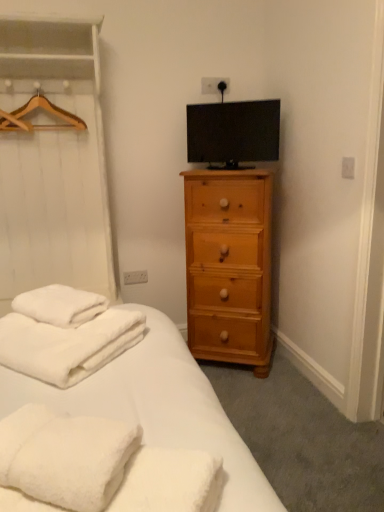
Where is `matte black tv at upper center`? The width and height of the screenshot is (384, 512). matte black tv at upper center is located at coordinates (233, 133).

Does wooden hanger at upper left come in front of matte black tv at upper center?

Yes, the depth of wooden hanger at upper left is less than that of matte black tv at upper center.

From a real-world perspective, which object rests below the other?

In real-world perspective, matte black tv at upper center is lower.

From the image's perspective, does wooden hanger at upper left appear lower than matte black tv at upper center?

Incorrect, from the image's perspective, wooden hanger at upper left is higher than matte black tv at upper center.

Measure the distance from light brown wood chest of drawers at right to white fluffy towels at lower left.

They are 1.08 meters apart.

Is light brown wood chest of drawers at right facing away from white fluffy towels at lower left?

light brown wood chest of drawers at right does not have its back to white fluffy towels at lower left.

Considering the relative sizes of light brown wood chest of drawers at right and white fluffy towels at lower left in the image provided, is light brown wood chest of drawers at right thinner than white fluffy towels at lower left?

Indeed, light brown wood chest of drawers at right has a lesser width compared to white fluffy towels at lower left.

In terms of height, does light brown wood chest of drawers at right look taller or shorter compared to white fluffy towels at lower left?

In the image, light brown wood chest of drawers at right appears to be taller than white fluffy towels at lower left.

Considering the positions of objects white fluffy towels at lower left and wooden hanger at upper left in the image provided, who is behind, white fluffy towels at lower left or wooden hanger at upper left?

wooden hanger at upper left is behind.

Is white fluffy towels at lower left far away from wooden hanger at upper left?

Indeed, white fluffy towels at lower left is not near wooden hanger at upper left.

Between white fluffy towels at lower left and wooden hanger at upper left, which one appears on the left side from the viewer's perspective?

wooden hanger at upper left.

Does white fluffy towels at lower left turn towards wooden hanger at upper left?

No, white fluffy towels at lower left is not oriented towards wooden hanger at upper left.

Is the depth of matte black tv at upper center greater than that of wooden hanger at upper left?

Yes, matte black tv at upper center is behind wooden hanger at upper left.

Does point (278, 135) lie behind point (26, 121)?

That is True.

The height and width of the screenshot is (512, 384). Find the location of `television below the wooden hanger at upper left (from a real-world perspective)`. television below the wooden hanger at upper left (from a real-world perspective) is located at coordinates (233, 133).

Does matte black tv at upper center touch wooden hanger at upper left?

matte black tv at upper center and wooden hanger at upper left are clearly separated.

Does wooden hanger at upper left lie behind white fluffy towels at lower left?

Yes, wooden hanger at upper left is further from the viewer.

Is wooden hanger at upper left inside or outside of white fluffy towels at lower left?

wooden hanger at upper left lies outside white fluffy towels at lower left.

Is wooden hanger at upper left thinner than white fluffy towels at lower left?

Indeed, wooden hanger at upper left has a lesser width compared to white fluffy towels at lower left.

From a real-world perspective, is wooden hanger at upper left physically located above or below white fluffy towels at lower left?

From a real-world perspective, wooden hanger at upper left is physically above white fluffy towels at lower left.

Looking at this image, is matte black tv at upper center next to light brown wood chest of drawers at right and touching it?

No, matte black tv at upper center is not with light brown wood chest of drawers at right.

From a real-world perspective, which is physically above, matte black tv at upper center or light brown wood chest of drawers at right?

matte black tv at upper center.

Measure the distance from matte black tv at upper center to light brown wood chest of drawers at right.

A distance of 17.30 inches exists between matte black tv at upper center and light brown wood chest of drawers at right.

Which object is further away from the camera, matte black tv at upper center or light brown wood chest of drawers at right?

matte black tv at upper center is further away from the camera.

Does light brown wood chest of drawers at right have a lesser width compared to matte black tv at upper center?

Incorrect, the width of light brown wood chest of drawers at right is not less than that of matte black tv at upper center.

Image resolution: width=384 pixels, height=512 pixels. What are the coordinates of `the chest of drawers in front of the matte black tv at upper center` in the screenshot? It's located at (229, 266).

Could you tell me if light brown wood chest of drawers at right is facing matte black tv at upper center?

No.

Considering the positions of objects light brown wood chest of drawers at right and matte black tv at upper center in the image provided, who is more to the right, light brown wood chest of drawers at right or matte black tv at upper center?

From the viewer's perspective, light brown wood chest of drawers at right appears more on the right side.

Locate an element on the screen. This screenshot has width=384, height=512. hanger above the matte black tv at upper center (from a real-world perspective) is located at coordinates (34, 109).

Find the location of a particular element. The image size is (384, 512). the chest of drawers that is behind the white fluffy towels at lower left is located at coordinates (229, 266).

Considering their positions, is matte black tv at upper center positioned closer to wooden hanger at upper left than white fluffy towels at lower left?

The object closer to wooden hanger at upper left is matte black tv at upper center.

Looking at this image, estimate the real-world distances between objects in this image. Which object is closer to light brown wood chest of drawers at right, white fluffy towels at lower left or wooden hanger at upper left?

The object closer to light brown wood chest of drawers at right is wooden hanger at upper left.

Considering their positions, is white fluffy towels at lower left positioned closer to matte black tv at upper center than wooden hanger at upper left?

wooden hanger at upper left lies closer to matte black tv at upper center than the other object.

Considering their positions, is wooden hanger at upper left positioned closer to light brown wood chest of drawers at right than white fluffy towels at lower left?

wooden hanger at upper left.

Considering their positions, is wooden hanger at upper left positioned further to matte black tv at upper center than white fluffy towels at lower left?

white fluffy towels at lower left.

From the image, which object appears to be nearer to wooden hanger at upper left, white fluffy towels at lower left or matte black tv at upper center?

matte black tv at upper center is positioned closer to the anchor wooden hanger at upper left.

Considering their positions, is wooden hanger at upper left positioned further to white fluffy towels at lower left than light brown wood chest of drawers at right?

wooden hanger at upper left.

When comparing their distances from wooden hanger at upper left, does light brown wood chest of drawers at right or matte black tv at upper center seem further?

The object further to wooden hanger at upper left is light brown wood chest of drawers at right.

Locate an element on the screen. This screenshot has width=384, height=512. hanger between white fluffy towels at lower left and matte black tv at upper center along the z-axis is located at coordinates (34, 109).

Locate an element on the screen. the chest of drawers positioned between white fluffy towels at lower left and matte black tv at upper center from near to far is located at coordinates (229, 266).

Where is `television between wooden hanger at upper left and light brown wood chest of drawers at right from left to right`? The image size is (384, 512). television between wooden hanger at upper left and light brown wood chest of drawers at right from left to right is located at coordinates (233, 133).

Locate an element on the screen. The height and width of the screenshot is (512, 384). hanger between white fluffy towels at lower left and light brown wood chest of drawers at right from front to back is located at coordinates (34, 109).